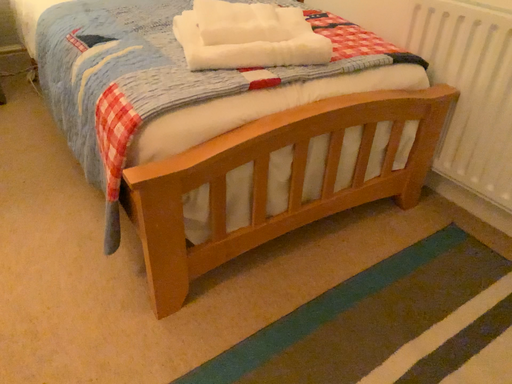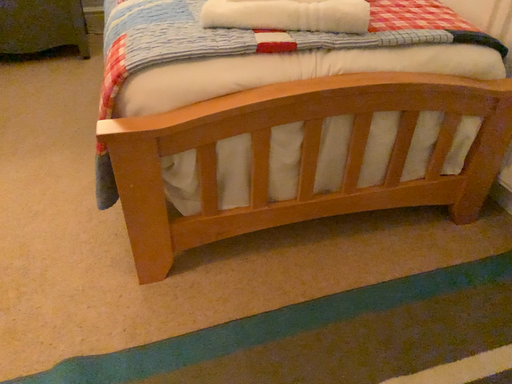
Question: How did the camera likely rotate when shooting the video?

Choices:
 (A) rotated left
 (B) rotated right

Answer: (A)